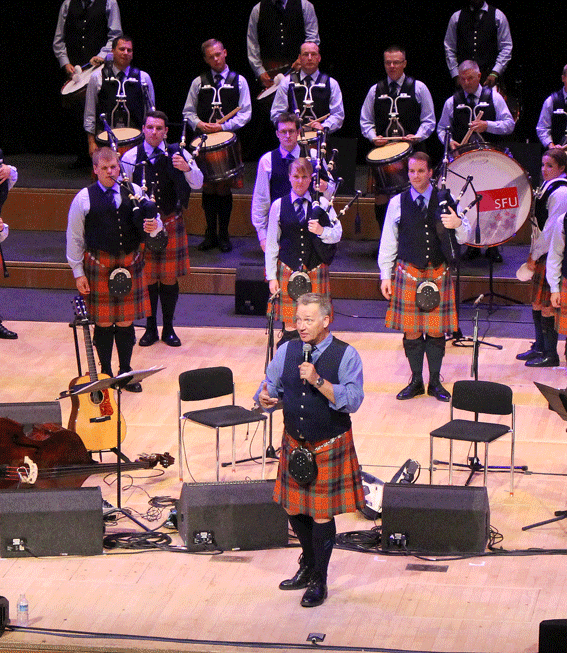
Find the location of a particular element. speakers is located at coordinates (53, 512), (236, 518), (423, 505).